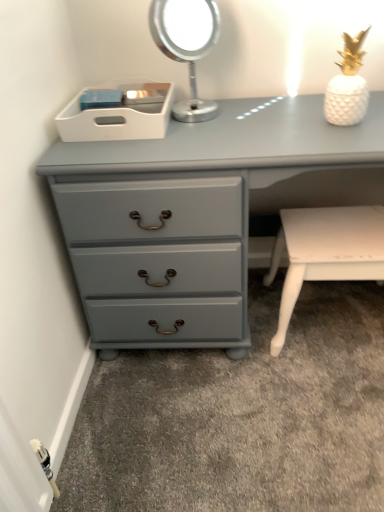
Locate an element on the screen. vacant area that is situated to the right of metallic silver mirror at upper center is located at coordinates (256, 112).